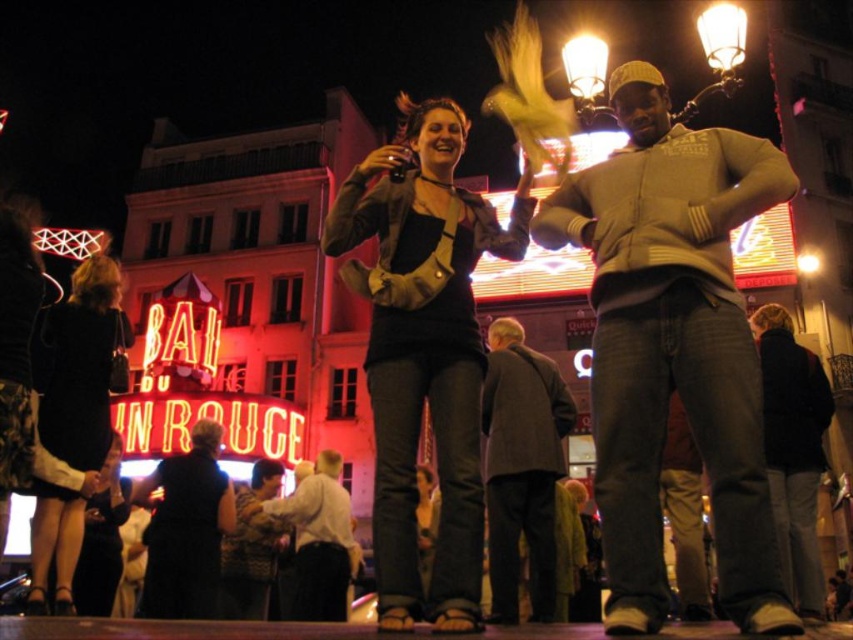
Question: Is gray wool coat at center thinner than black dress at center?

Choices:
 (A) no
 (B) yes

Answer: (B)

Question: Which object is positioned closest to the patterned fabric dress at center?

Choices:
 (A) dark gray jeans at lower right
 (B) black dress at center

Answer: (B)

Question: In this image, where is dark gray jeans at lower right located relative to patterned fabric dress at center?

Choices:
 (A) right
 (B) left

Answer: (A)

Question: Based on their relative distances, which object is nearer to the black dress at center?

Choices:
 (A) black leather jacket at lower left
 (B) gray wool coat at center

Answer: (A)

Question: Which point is closer to the camera?

Choices:
 (A) black fabric dress at lower left
 (B) light beige sweater at center
 (C) black dress at center
 (D) gray wool coat at center

Answer: (B)

Question: Is dark gray jeans at lower right behind patterned fabric dress at center?

Choices:
 (A) no
 (B) yes

Answer: (A)